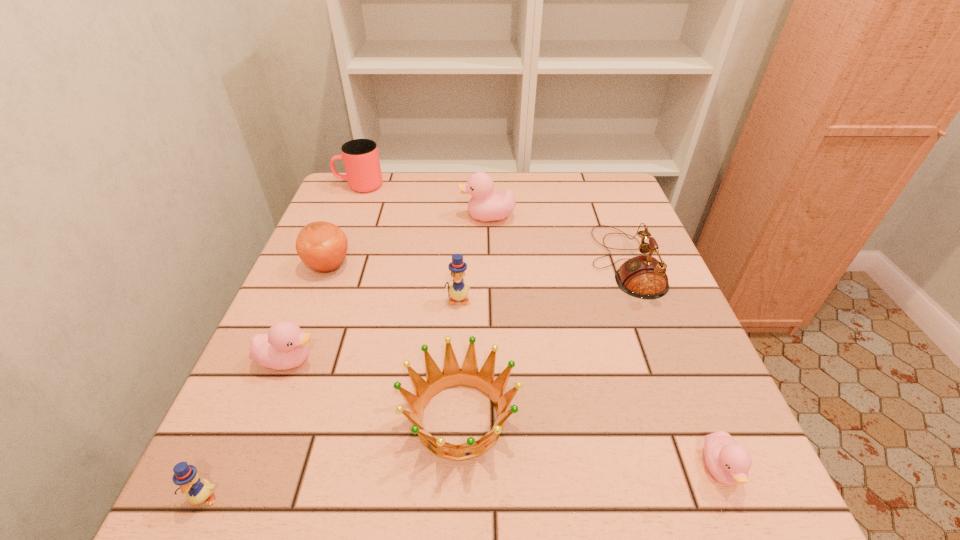
Locate an element on the screen. The image size is (960, 540). free space at the near right corner of the desktop is located at coordinates (699, 488).

At what (x,y) coordinates should I click in order to perform the action: click on vacant area that lies between the golden crown and the pink telephone. Please return your answer as a coordinate pair (x, y). Looking at the image, I should click on (542, 340).

Find the location of `vacant point located between the smaller yellow duckling and the golden crown`. vacant point located between the smaller yellow duckling and the golden crown is located at coordinates (332, 457).

The height and width of the screenshot is (540, 960). I want to click on free space between the pink telephone and the cup, so click(492, 224).

Locate an element on the screen. vacant point located between the crown and the smaller yellow duckling is located at coordinates (332, 457).

Where is `vacant space that's between the farthest duckling and the left yellow duckling`? The image size is (960, 540). vacant space that's between the farthest duckling and the left yellow duckling is located at coordinates (346, 357).

You are a GUI agent. You are given a task and a screenshot of the screen. Output one action in this format:
    pyautogui.click(x=<x>, y=<y>)
    Task: Click on the free space between the golden crown and the leftmost pink duckling
    The image size is (960, 540).
    Given the screenshot: What is the action you would take?
    pyautogui.click(x=374, y=389)

Identify the location of empty space between the biggest pink duckling and the smaller yellow duckling. The width and height of the screenshot is (960, 540). coord(346,357).

This screenshot has height=540, width=960. What are the coordinates of `free spot between the golden crown and the second farthest duckling` in the screenshot? It's located at (459, 359).

The height and width of the screenshot is (540, 960). Identify the location of vacant area that lies between the crown and the right yellow duckling. (459, 359).